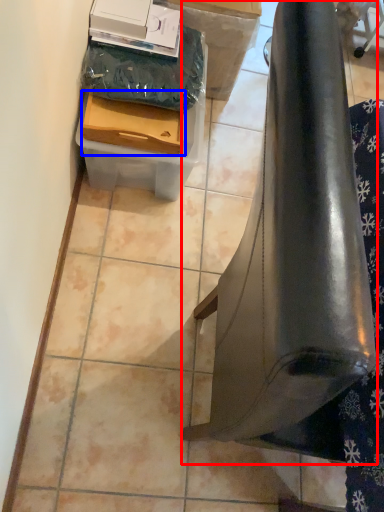
Question: Among these objects, which one is farthest to the camera, furniture (highlighted by a red box) or box (highlighted by a blue box)?

Choices:
 (A) furniture
 (B) box

Answer: (B)